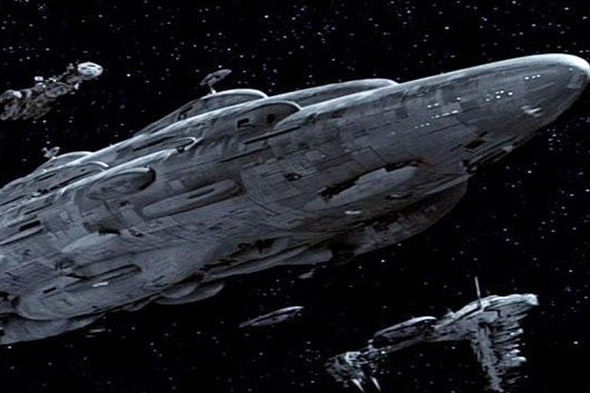
Where is `saucer`? The width and height of the screenshot is (590, 393). saucer is located at coordinates (275, 312).